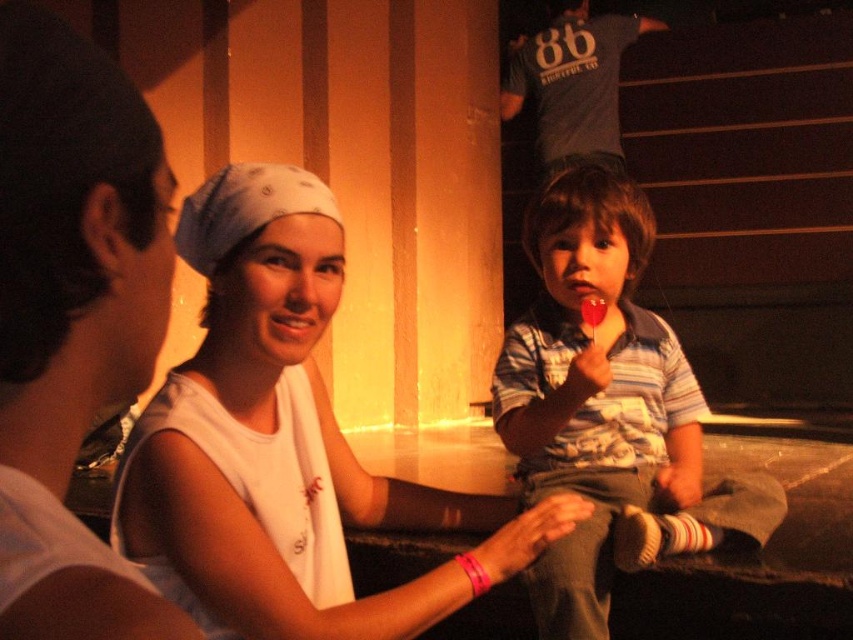
Question: Which of the following is the closest to the observer?

Choices:
 (A) (276, 339)
 (B) (608, 394)

Answer: (A)

Question: Is white fabric headband at center positioned at the back of striped cotton shirt at center?

Choices:
 (A) no
 (B) yes

Answer: (A)

Question: Is white fabric headband at center closer to camera compared to striped cotton shirt at center?

Choices:
 (A) yes
 (B) no

Answer: (A)

Question: Which point is closer to the camera?

Choices:
 (A) white fabric headband at center
 (B) striped cotton shirt at center

Answer: (A)

Question: Is white fabric headband at center to the left of striped cotton shirt at center from the viewer's perspective?

Choices:
 (A) yes
 (B) no

Answer: (A)